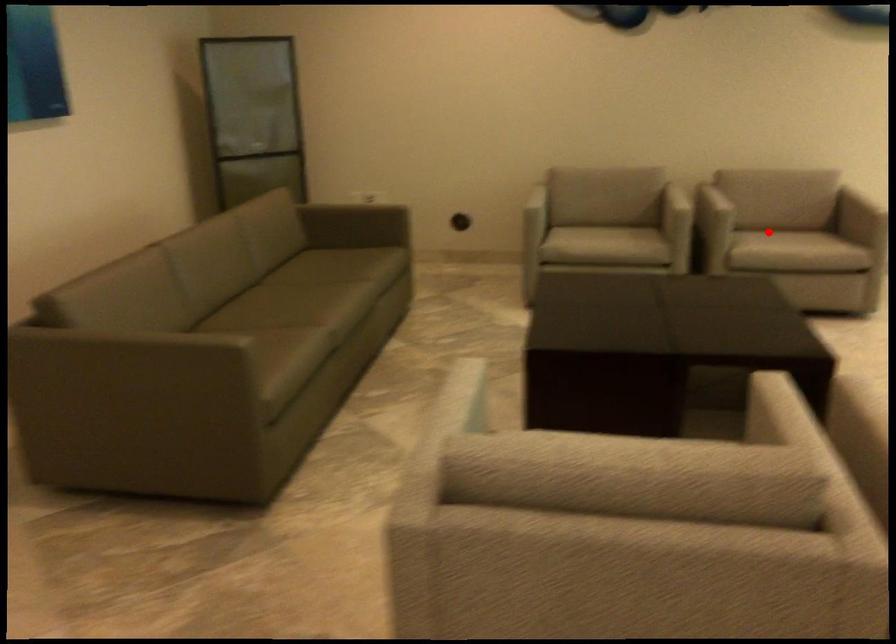
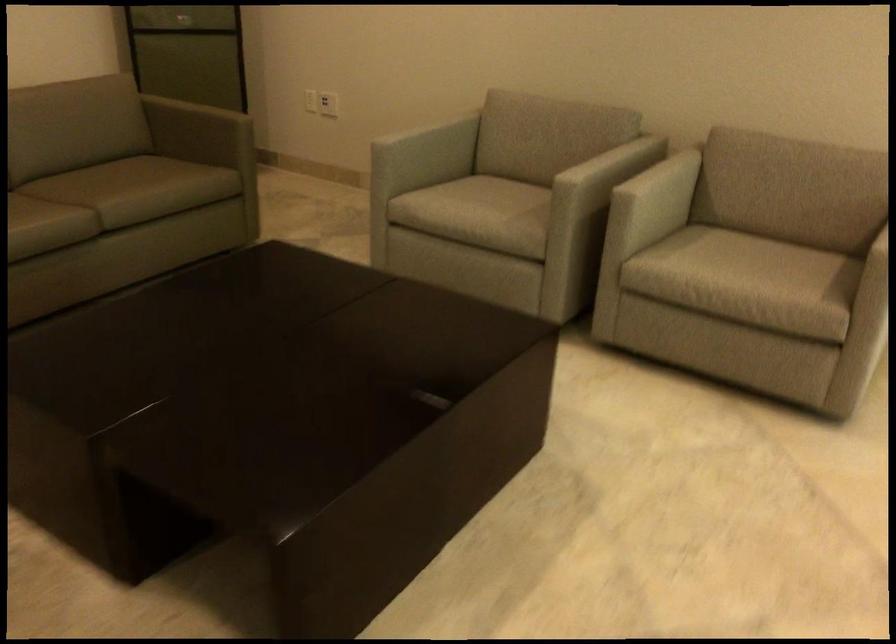
In the second image, find the point that corresponds to the highlighted location in the first image.

(739, 257)